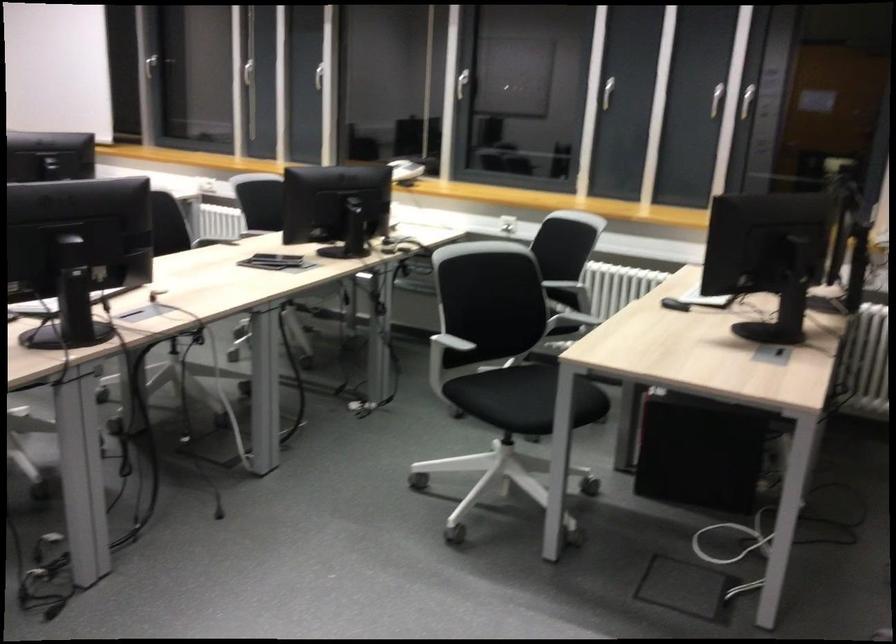
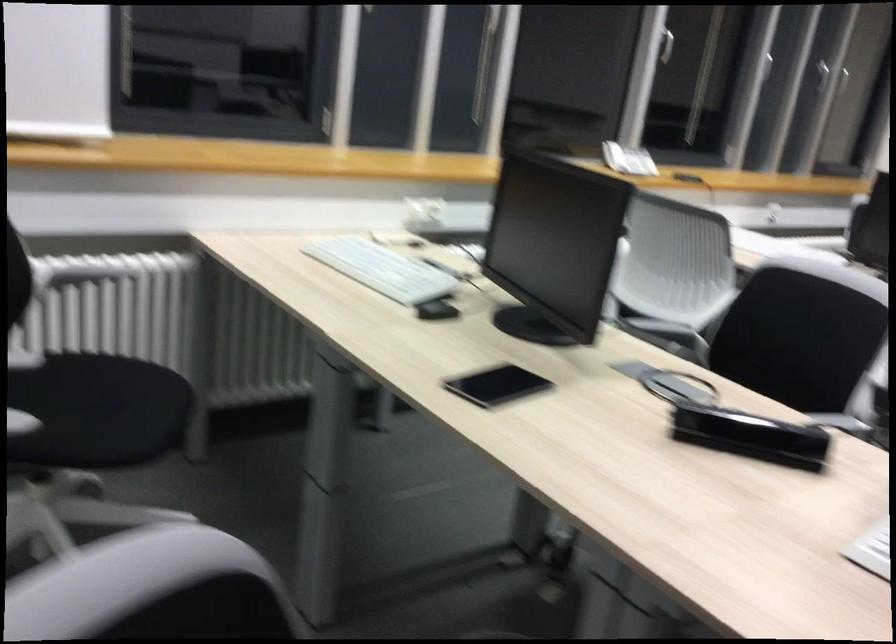
The point at (x=460, y=80) is marked in the first image. Where is the corresponding point in the second image?

(666, 46)